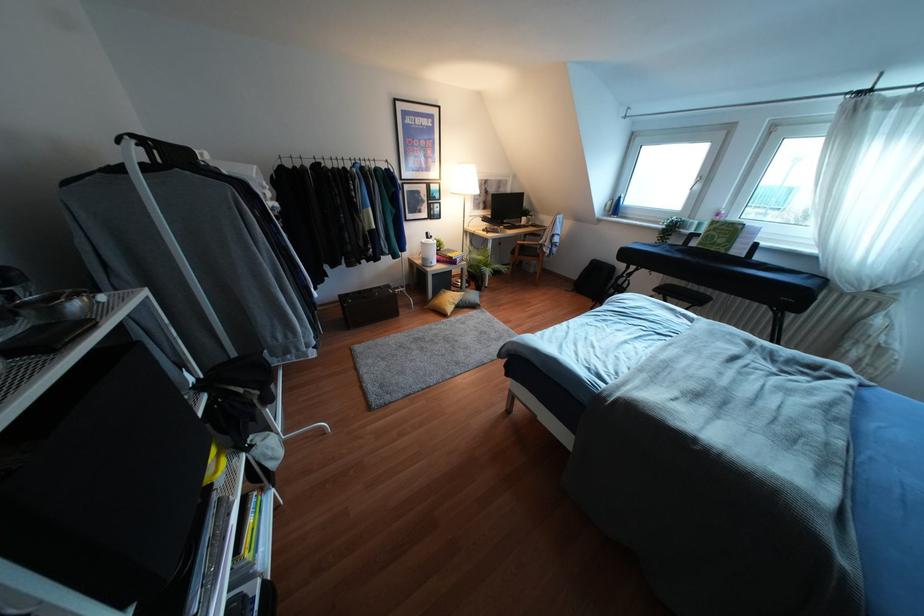
The location [428,251] corresponds to which object?

It refers to a white cylindrical bottle.